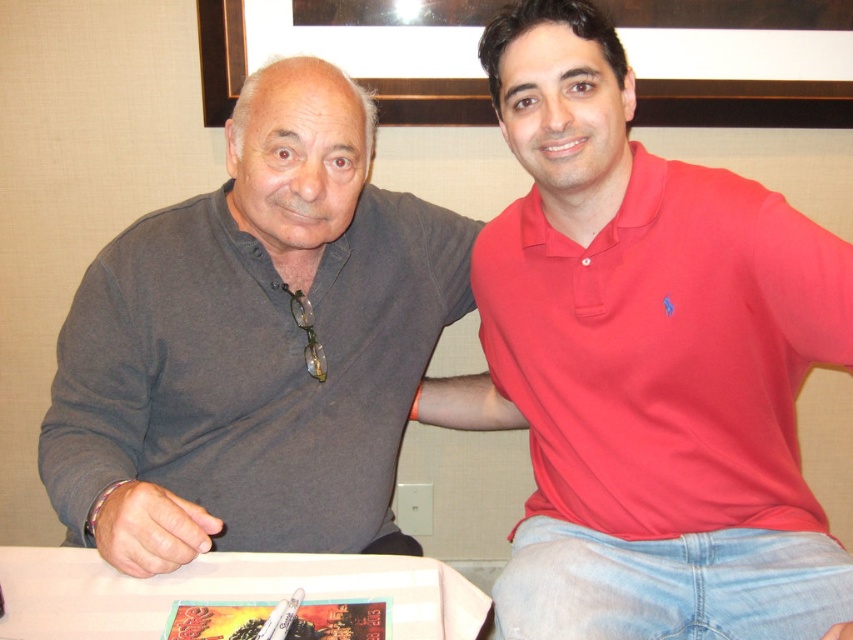
You are standing at the center of the table and want to place a small gift between the two points labeled point (374, 436) and point (451, 116). Which point should you move towards to ensure the gift is closer to the person on the right?

You should move towards point (374, 436) because it is in front of point (451, 116), meaning it is closer to the person on the right.

You are a photographer setting up for a group photo. You have a camera with a 10 inch wide lens. The two subjects are wearing the red cotton polo shirt at center and the matte gray sweater at left. Can you fit both subjects into the frame without moving the camera?

The red cotton polo shirt at center is 13.90 inches from the matte gray sweater at left. Since the distance between them is greater than the 10 inch wide lens, you cannot fit both subjects into the frame without moving the camera.

You are organizing a small event and need to place a decorative item on the table. The wooden picture frame at upper center is currently placed where you want to put a larger item. Can the matte gray sweater at left be placed in that spot without needing to adjust its size?

The matte gray sweater at left is wider than the wooden picture frame at upper center, so placing it in the frame